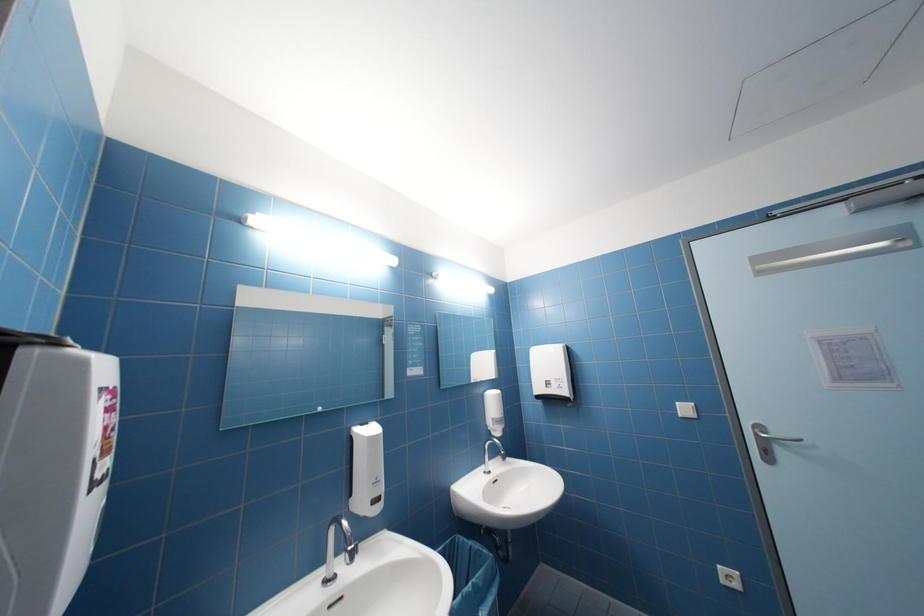
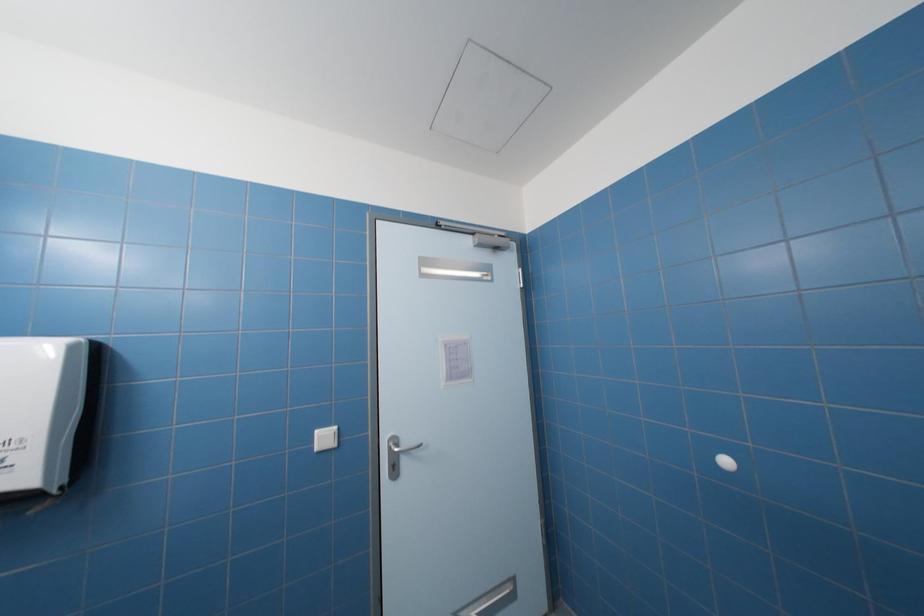
Question: The images are taken continuously from a first-person perspective. In which direction is your viewpoint rotating?

Choices:
 (A) Left
 (B) Right
 (C) Up
 (D) Down

Answer: (B)